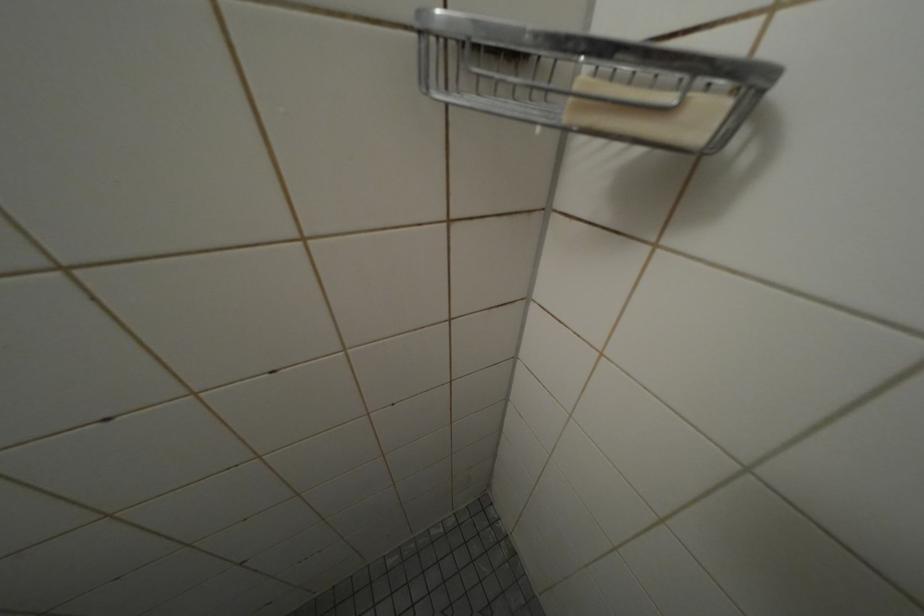
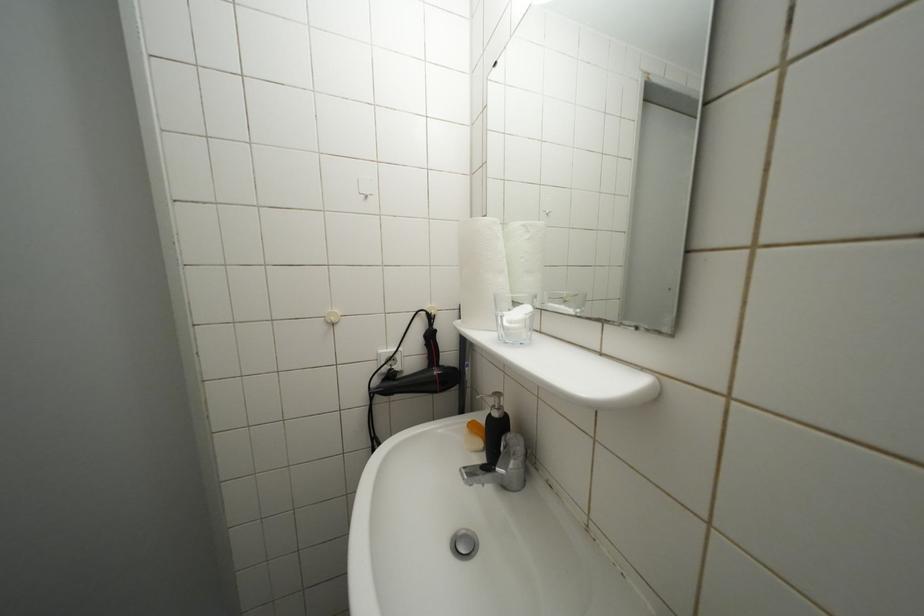
Question: The camera is either moving clockwise (left) or counter-clockwise (right) around the object. The first image is from the beginning of the video and the second image is from the end. Is the camera moving left or right when shooting the video?

Choices:
 (A) Left
 (B) Right

Answer: (B)